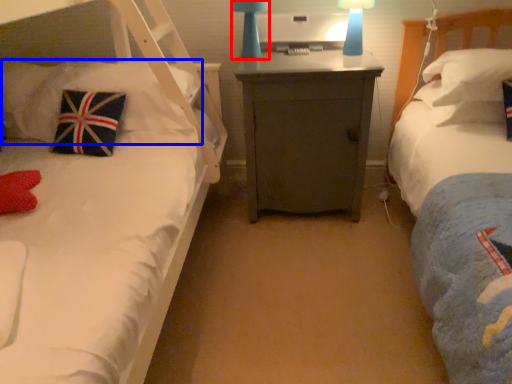
Question: Which of the following is the closest to the observer, bedside lamp (highlighted by a red box) or pillow (highlighted by a blue box)?

Choices:
 (A) bedside lamp
 (B) pillow

Answer: (B)